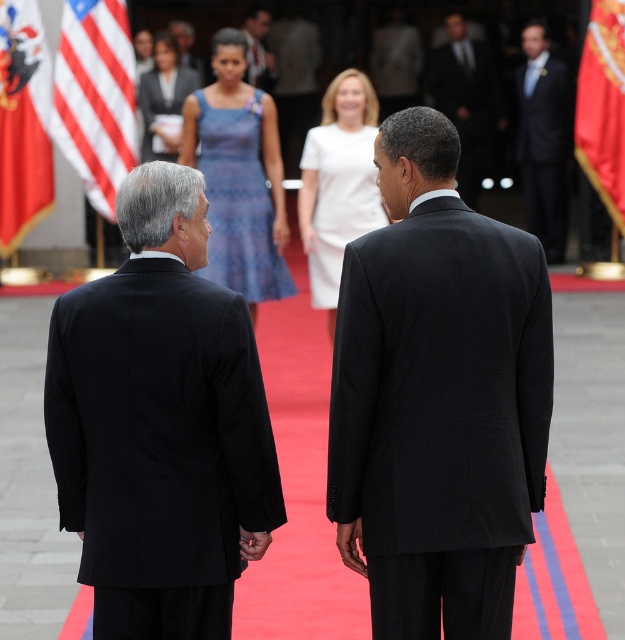
Looking at this image, you are a photographer at a diplomatic event. You need to capture a photo that includes both the black suit at upper right and the red fabric flag at right. Based on their positions, which object is closer to the left edge of the photo?

The black suit at upper right is positioned on the left side of the red fabric flag at right, so it is closer to the left edge of the photo.